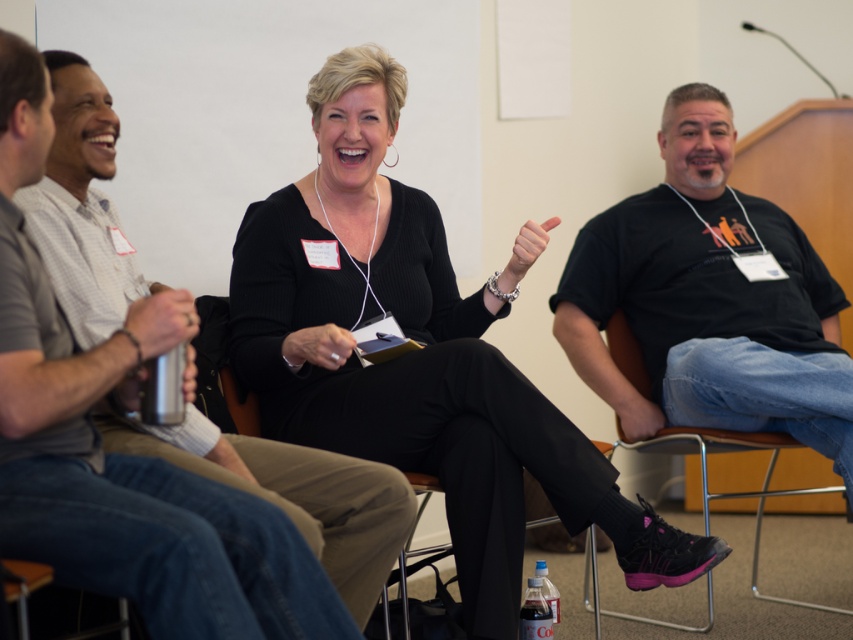
Question: Can you confirm if matte silver water bottle at left is smaller than black fabric chair at lower center?

Choices:
 (A) yes
 (B) no

Answer: (B)

Question: Among these points, which one is farthest from the camera?

Choices:
 (A) (660, 560)
 (B) (627, 368)
 (C) (207, 499)

Answer: (B)

Question: Does black matte/black textured pants at center have a smaller size compared to metallic silver chair at lower right?

Choices:
 (A) no
 (B) yes

Answer: (A)

Question: Can you confirm if black cotton t-shirt at right is thinner than metallic silver chair at lower right?

Choices:
 (A) no
 (B) yes

Answer: (A)

Question: Which point is closer to the camera?

Choices:
 (A) metallic silver chair at lower right
 (B) matte silver water bottle at left

Answer: (B)

Question: Estimate the real-world distances between objects in this image. Which object is closer to the black matte/black textured pants at center?

Choices:
 (A) matte silver water bottle at left
 (B) black cotton t-shirt at right

Answer: (A)